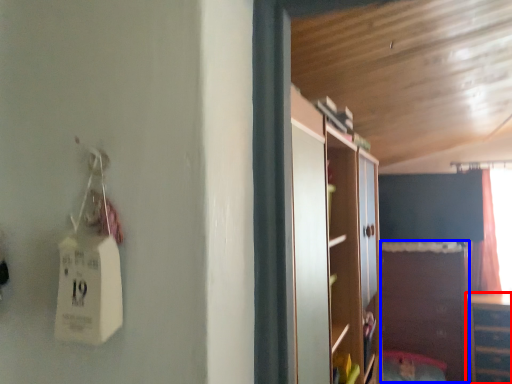
Question: Among these objects, which one is nearest to the camera, cabinetry (highlighted by a red box) or cabinetry (highlighted by a blue box)?

Choices:
 (A) cabinetry
 (B) cabinetry

Answer: (A)